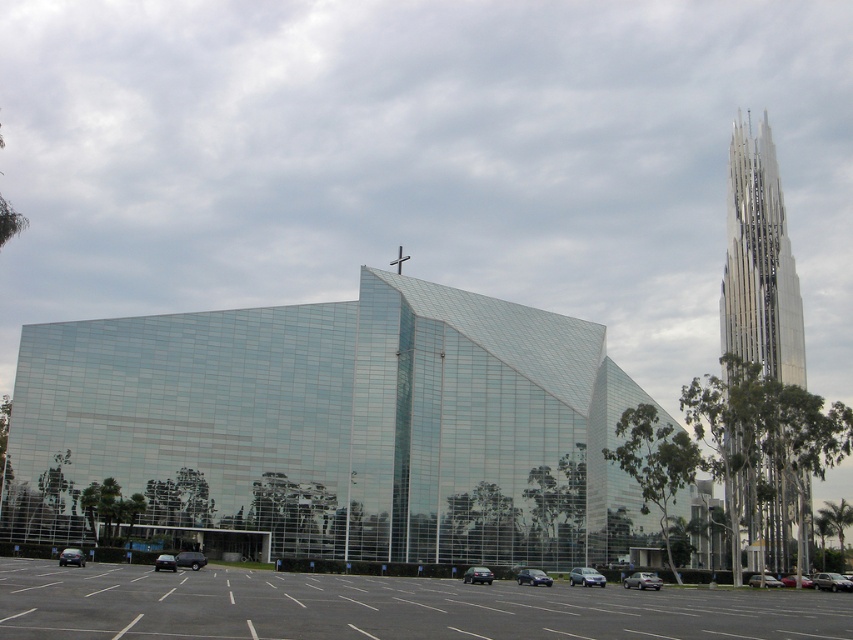
Can you confirm if shiny black sedan at center is positioned below metallic silver car at lower right?

Incorrect, shiny black sedan at center is not positioned below metallic silver car at lower right.

Does shiny black sedan at center appear on the right side of metallic silver car at lower right?

In fact, shiny black sedan at center is to the left of metallic silver car at lower right.

What are the coordinates of `shiny black sedan at center` in the screenshot? It's located at (532, 577).

Based on the photo, who is taller, metallic gray sedan at center or metallic red car at center?

With more height is metallic gray sedan at center.

Who is more distant from viewer, (824, 584) or (807, 588)?

Point (807, 588)

At what (x,y) coordinates should I click in order to perform the action: click on metallic gray sedan at center. Please return your answer as a coordinate pair (x, y). The image size is (853, 640). Looking at the image, I should click on (831, 580).

Who is positioned more to the left, silver metallic sedan at center or metallic silver car at lower right?

silver metallic sedan at center

Who is more forward, [584,570] or [756,586]?

Point [584,570] is in front.

Which is in front, point (582, 566) or point (775, 582)?

Point (775, 582) is in front.

Locate an element on the screen. The height and width of the screenshot is (640, 853). silver metallic sedan at center is located at coordinates (585, 577).